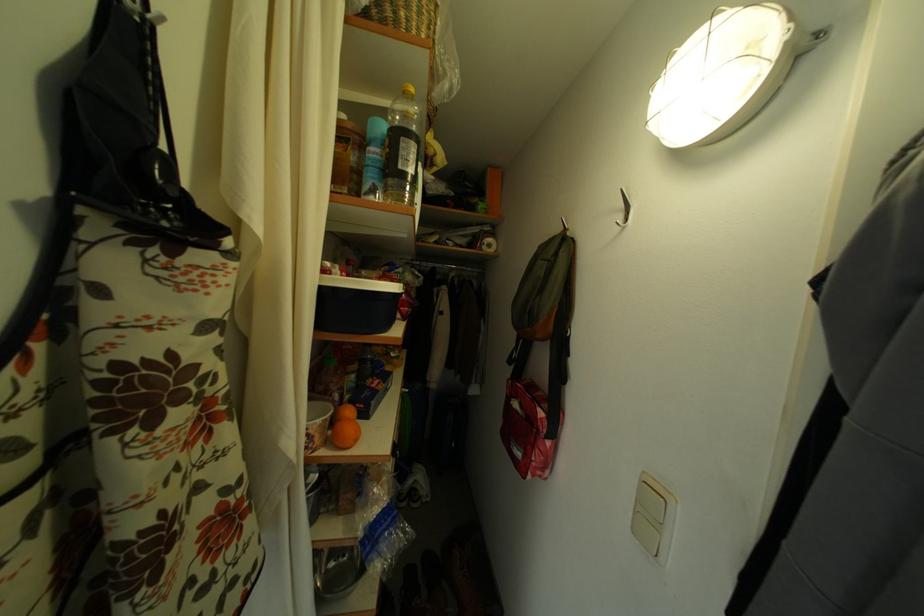
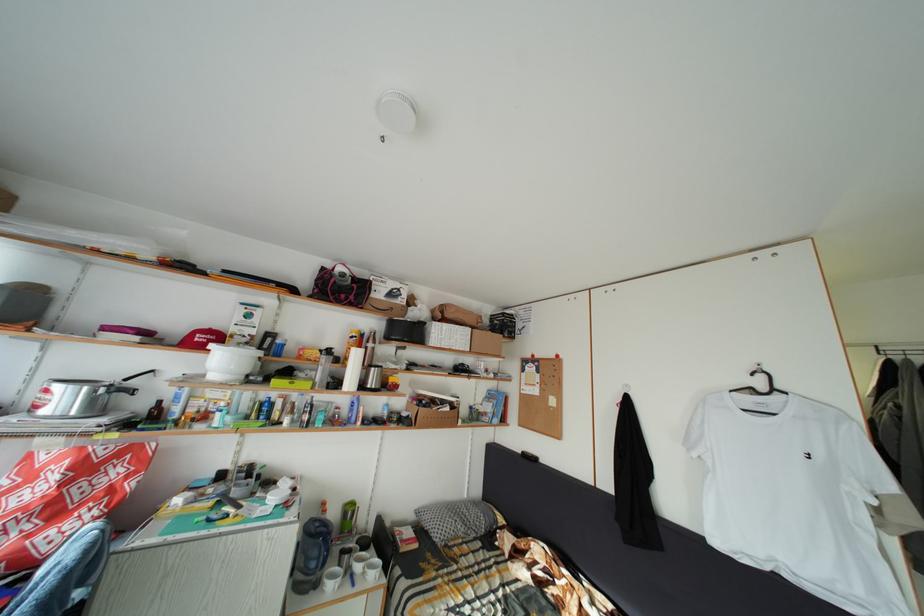
Question: What movement of the cameraman would produce the second image?

Choices:
 (A) Left
 (B) Right
 (C) Forward
 (D) Backward

Answer: (A)